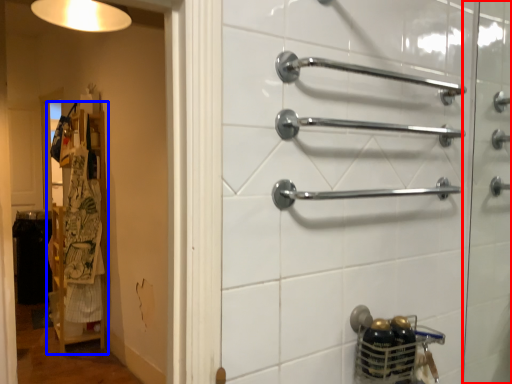
Question: Which object appears farthest to the camera in this image, screen door (highlighted by a red box) or closet (highlighted by a blue box)?

Choices:
 (A) screen door
 (B) closet

Answer: (B)